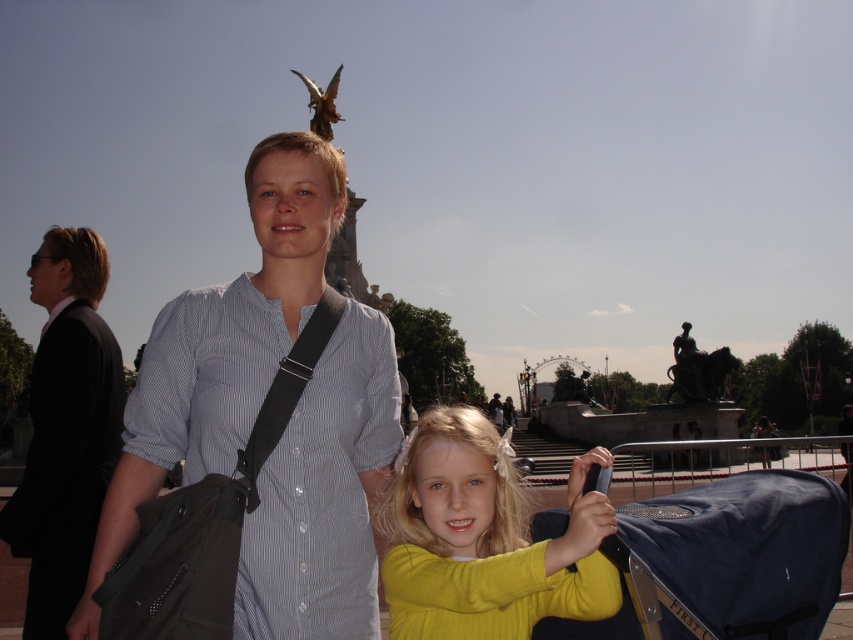
Question: Does yellow matte shirt at center have a lesser width compared to matte black shirt at center?

Choices:
 (A) no
 (B) yes

Answer: (A)

Question: Which of these objects is positioned farthest from the yellow matte shirt at center?

Choices:
 (A) matte black shirt at center
 (B) matte blue shirt at center
 (C) blue fabric baby carriage at lower right

Answer: (A)

Question: Can you confirm if matte blue shirt at center is thinner than yellow matte shirt at center?

Choices:
 (A) no
 (B) yes

Answer: (B)

Question: Is matte blue shirt at center above yellow matte shirt at center?

Choices:
 (A) yes
 (B) no

Answer: (A)

Question: Which of the following is the farthest from the observer?

Choices:
 (A) (502, 512)
 (B) (77, 561)
 (C) (167, 420)
 (D) (695, 582)

Answer: (B)

Question: Which object is farther from the camera taking this photo?

Choices:
 (A) matte blue shirt at center
 (B) blue fabric baby carriage at lower right
 (C) matte black shirt at center

Answer: (C)